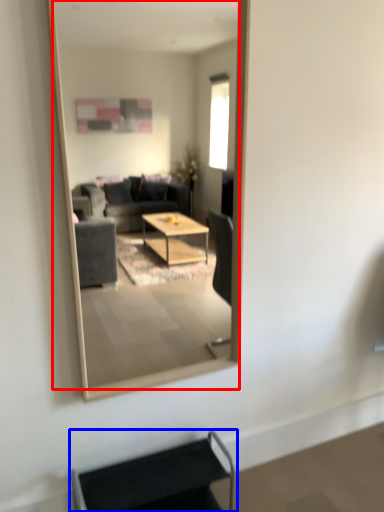
Question: Which point is closer to the camera, mirror (highlighted by a red box) or armchair (highlighted by a blue box)?

Choices:
 (A) mirror
 (B) armchair

Answer: (A)